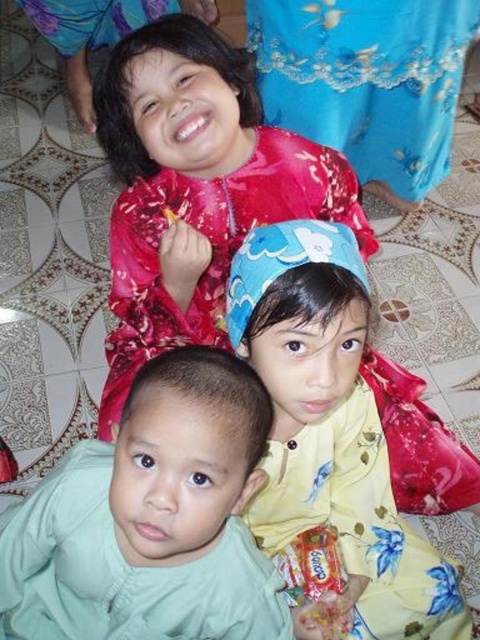
Is point (90, 477) closer to viewer compared to point (275, 205)?

Yes, it is in front of point (275, 205).

Locate an element on the screen. The image size is (480, 640). light green fabric at center is located at coordinates (152, 518).

You are a GUI agent. You are given a task and a screenshot of the screen. Output one action in this format:
    pyautogui.click(x=<x>, y=<y>)
    Task: Click on the light green fabric at center
    This screenshot has width=480, height=640.
    Given the screenshot: What is the action you would take?
    pyautogui.click(x=152, y=518)

Does yellow floral dress at center have a greater width compared to matte blue dress at upper center?

In fact, yellow floral dress at center might be narrower than matte blue dress at upper center.

Is point (427, 634) more distant than point (364, 182)?

No.

Identify the location of yellow floral dress at center. The image size is (480, 640). (332, 429).

Find the location of a particular element. The height and width of the screenshot is (640, 480). yellow floral dress at center is located at coordinates (332, 429).

Can you confirm if matte blue dress at upper center is thinner than blue satin robe at upper center?

In fact, matte blue dress at upper center might be wider than blue satin robe at upper center.

Between matte blue dress at upper center and blue satin robe at upper center, which one is positioned lower?

Positioned lower is matte blue dress at upper center.

Is point (317, 115) farther from viewer compared to point (62, 32)?

No, it is in front of (62, 32).

Find the location of a particular element. This screenshot has width=480, height=640. matte blue dress at upper center is located at coordinates (367, 80).